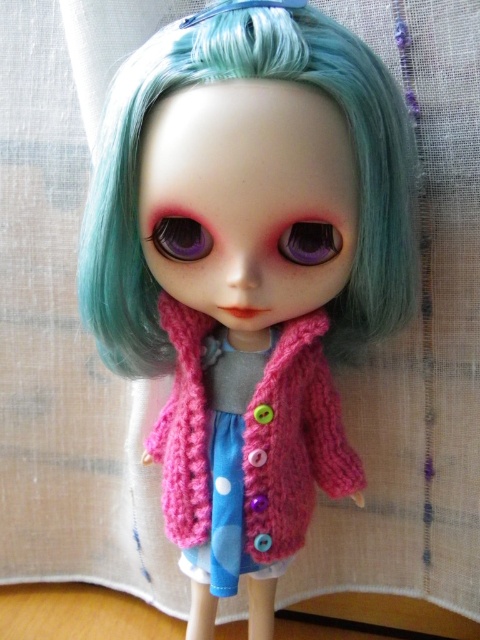
Question: Is pink knitted cardigan at center thinner than pink knitted dress at center?

Choices:
 (A) yes
 (B) no

Answer: (B)

Question: Is pink knitted cardigan at center below pink knitted dress at center?

Choices:
 (A) yes
 (B) no

Answer: (B)

Question: From the image, what is the correct spatial relationship of pink knitted cardigan at center in relation to pink knitted dress at center?

Choices:
 (A) above
 (B) below

Answer: (A)

Question: Which point is closer to the camera?

Choices:
 (A) (216, 483)
 (B) (212, 353)

Answer: (A)

Question: Among these objects, which one is farthest from the camera?

Choices:
 (A) pink knitted cardigan at center
 (B) pink knitted dress at center

Answer: (B)